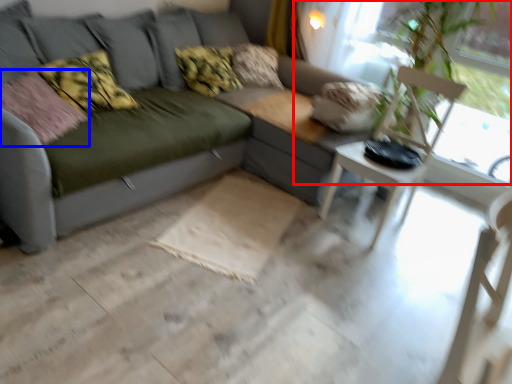
Question: Which object appears farthest to the camera in this image, window screen (highlighted by a red box) or pillow (highlighted by a blue box)?

Choices:
 (A) window screen
 (B) pillow

Answer: (A)